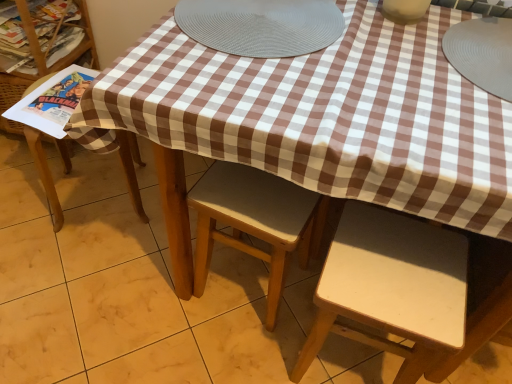
Locate an element on the screen. empty space that is ontop of light brown wood chair at center, which is counted as the 2th chair, starting from the right (from a real-world perspective) is located at coordinates (258, 196).